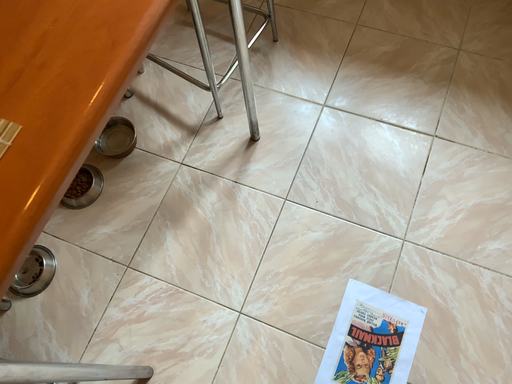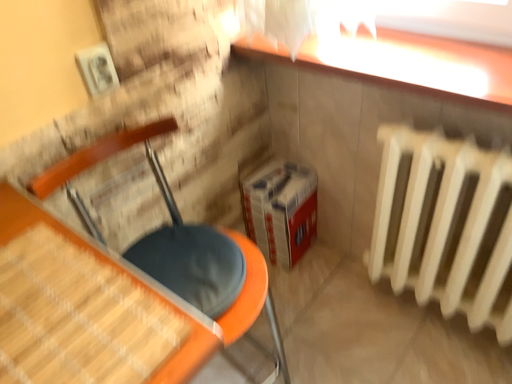
Question: Which way did the camera rotate in the video?

Choices:
 (A) rotated left
 (B) rotated right

Answer: (A)